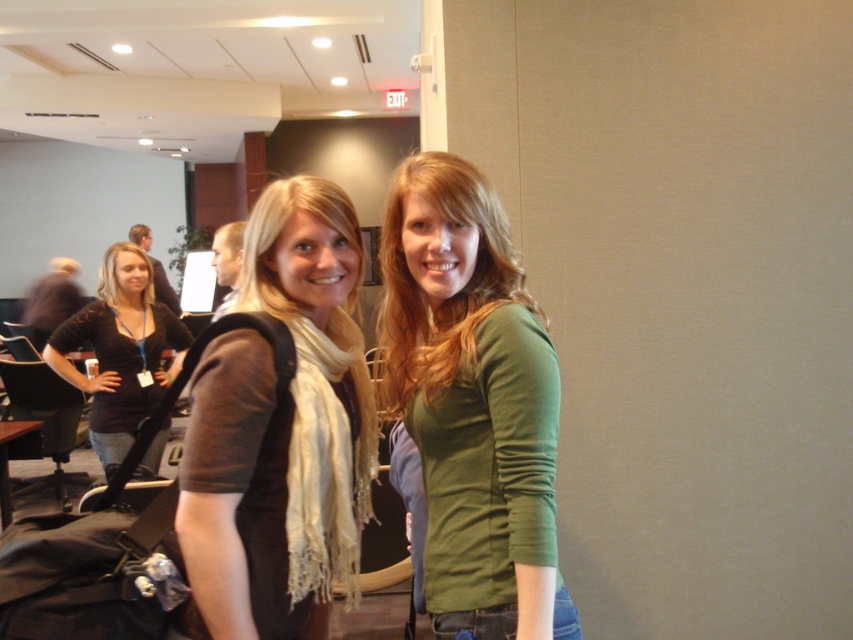
You are organizing a photo shoot and need to position two props correctly based on their current positions in the scene. The matte brown scarf at center and the black fabric shirt at left must be arranged such that the scarf is to the right of the shirt. Does the current arrangement already satisfy this requirement?

Yes, the current arrangement already satisfies the requirement because the matte brown scarf at center is to the right of the black fabric shirt at left as described.

You are standing in the conference room and want to move from the point at coordinates point (523,483) to the point at coordinates point (260,259). Which direction should you face to walk towards the second point?

To move from point (523,483) to point (260,259), you should face towards the northwest direction since point (523,483) is in front of point (260,259).